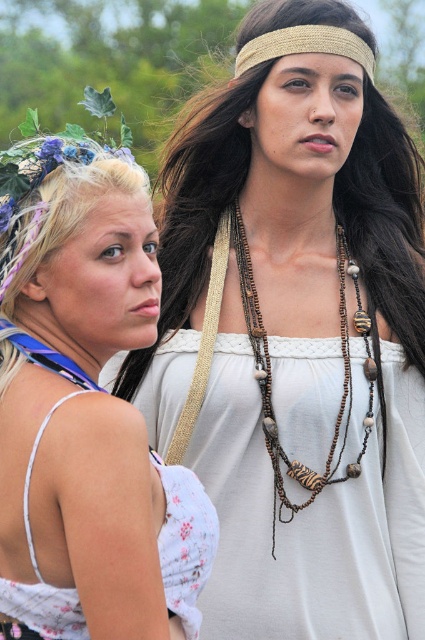
Consider the image. Can you confirm if brown beaded necklace at center is positioned to the left of gold woven headband at upper center?

Incorrect, brown beaded necklace at center is not on the left side of gold woven headband at upper center.

Between brown beaded necklace at center and gold woven headband at upper center, which one has less height?

With less height is gold woven headband at upper center.

Does point (283, 449) come closer to viewer compared to point (285, 44)?

Yes, point (283, 449) is closer to viewer.

This screenshot has width=425, height=640. What are the coordinates of `brown beaded necklace at center` in the screenshot? It's located at (271, 376).

Does white floral fabric dress at lower left have a greater width compared to brown beaded necklace at center?

No.

Is white floral fabric dress at lower left thinner than brown beaded necklace at center?

Yes.

Does point (48, 596) come farther from viewer compared to point (244, 308)?

No.

Find the location of a particular element. Image resolution: width=425 pixels, height=640 pixels. white floral fabric dress at lower left is located at coordinates (184, 541).

Looking at this image, can you confirm if white floral dress at left is positioned to the left of gold woven headband at upper center?

Yes, white floral dress at left is to the left of gold woven headband at upper center.

Is point (90, 326) less distant than point (323, 33)?

Yes.

This screenshot has height=640, width=425. What do you see at coordinates (87, 420) in the screenshot?
I see `white floral dress at left` at bounding box center [87, 420].

The height and width of the screenshot is (640, 425). Find the location of `white floral dress at left`. white floral dress at left is located at coordinates (87, 420).